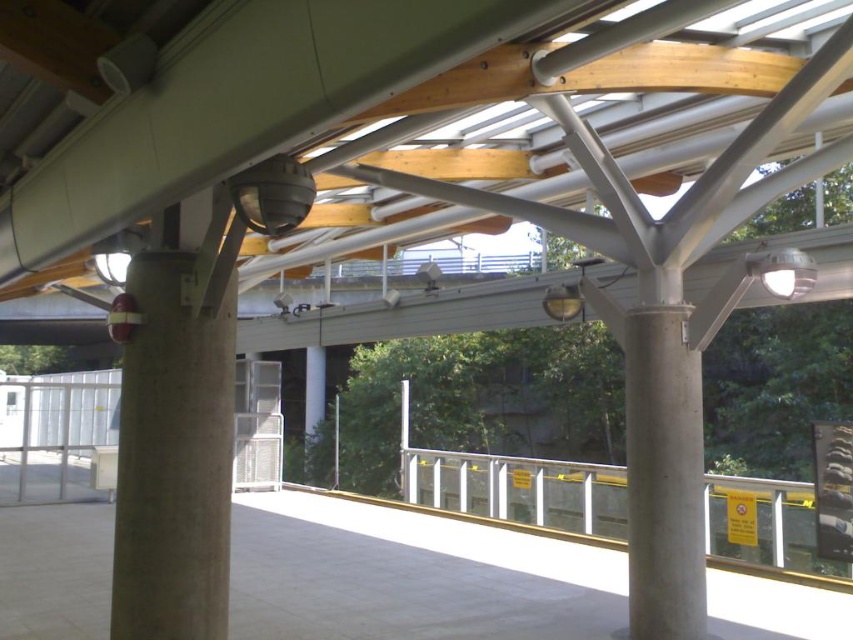
Between concrete at left and white concrete pillar at center, which one is positioned higher?

concrete at left is higher up.

Who is more distant from viewer, (x=129, y=557) or (x=656, y=572)?

Point (x=656, y=572)

Locate an element on the screen. concrete at left is located at coordinates (173, 458).